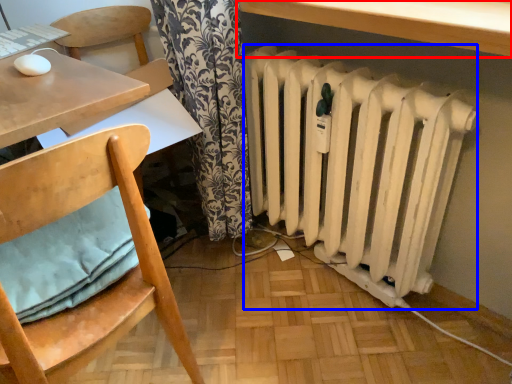
Question: Which object is further to the camera taking this photo, table (highlighted by a red box) or radiator (highlighted by a blue box)?

Choices:
 (A) table
 (B) radiator

Answer: (B)